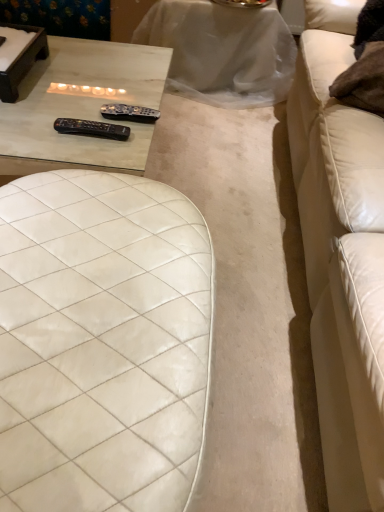
You are a GUI agent. You are given a task and a screenshot of the screen. Output one action in this format:
    pyautogui.click(x=<x>, y=<y>)
    Task: Click on the unoccupied region to the right of black plastic remote at center, positioned as the 1th remote in front-to-back order
    Image resolution: width=384 pixels, height=512 pixels.
    Given the screenshot: What is the action you would take?
    pyautogui.click(x=124, y=148)